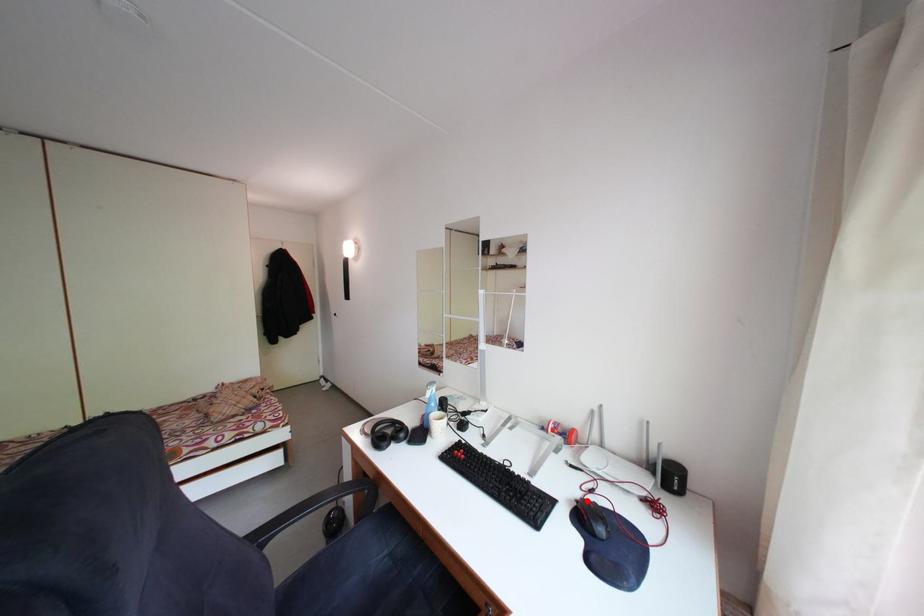
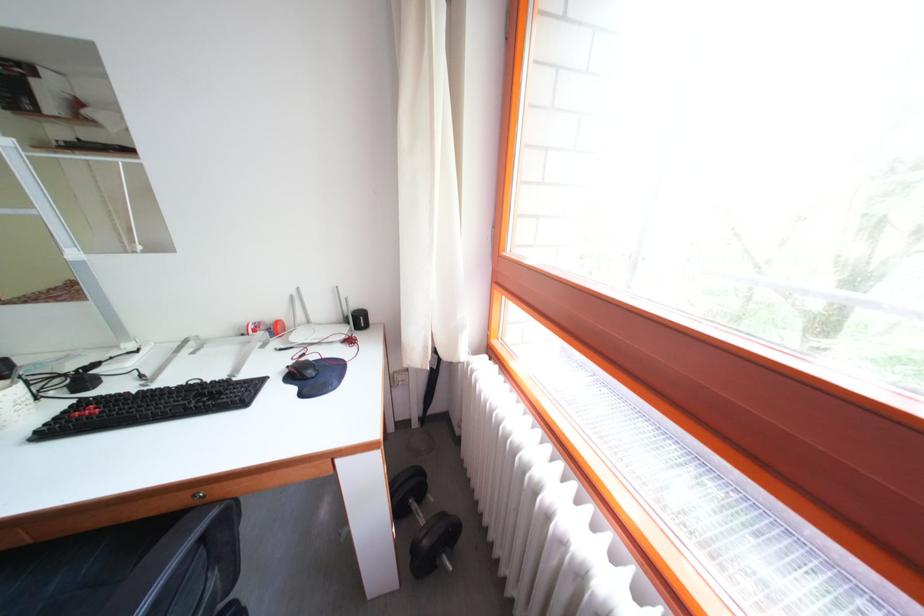
Locate, in the second image, the point that corresponds to the highlighted location in the first image.

(298, 370)